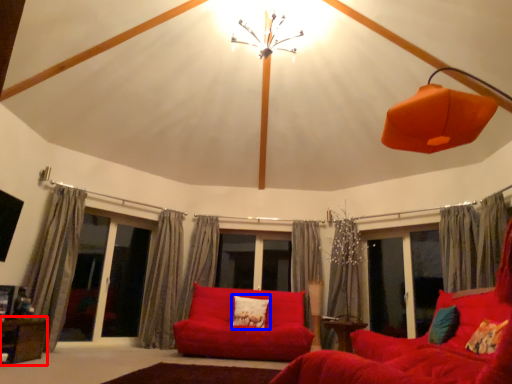
Question: Which point is further to the camera, table (highlighted by a red box) or pillow (highlighted by a blue box)?

Choices:
 (A) table
 (B) pillow

Answer: (B)